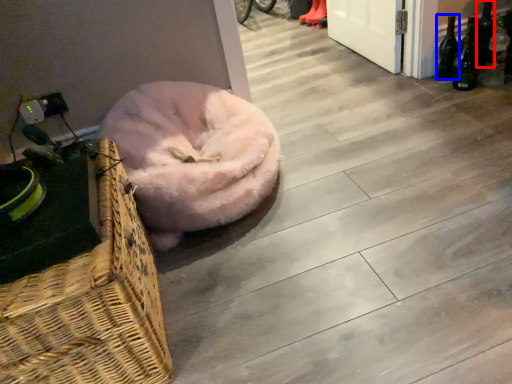
Question: Which point is further to the camera, bottle (highlighted by a red box) or bottle (highlighted by a blue box)?

Choices:
 (A) bottle
 (B) bottle

Answer: (A)